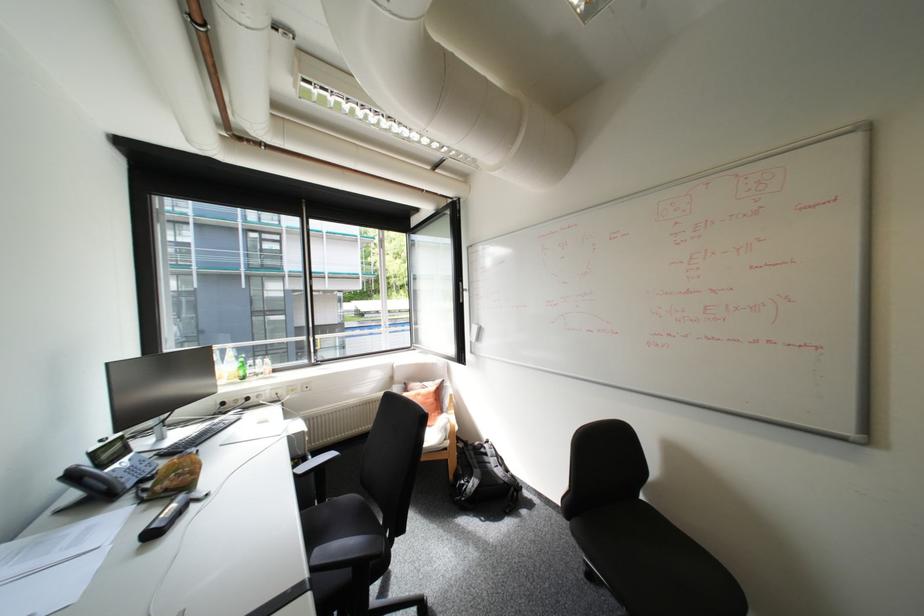
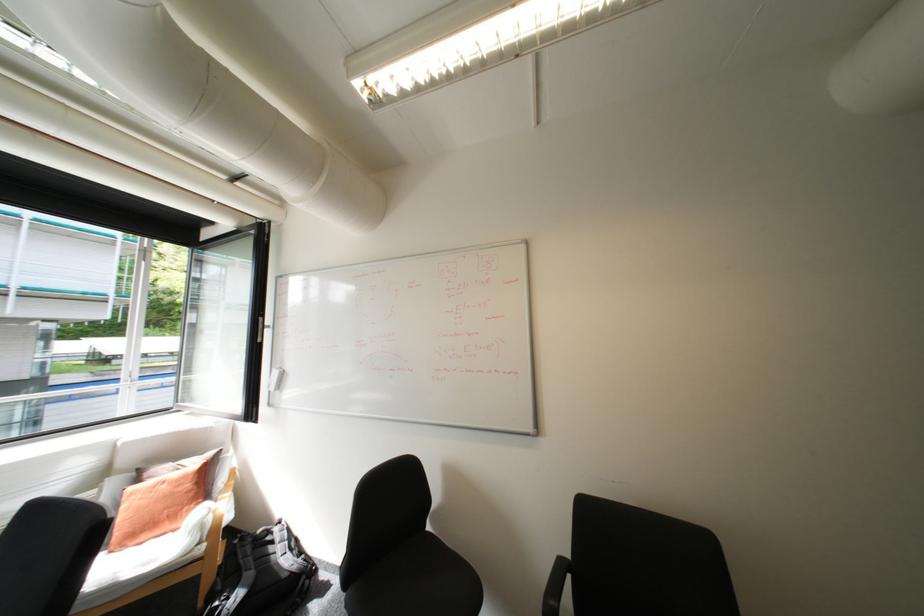
Locate, in the second image, the point that corresponds to pixel 479 482 in the first image.

(238, 599)